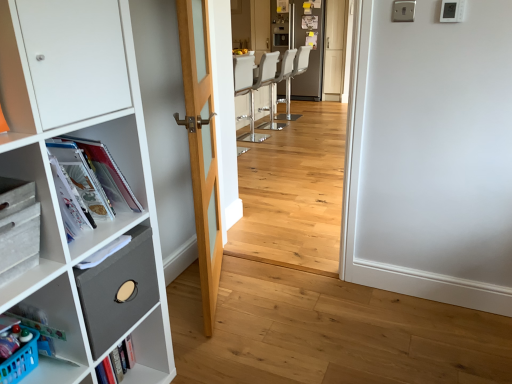
Find the location of a particular element. The height and width of the screenshot is (384, 512). light wood floor at center is located at coordinates (294, 191).

What is the approximate height of light wood floor at center?

The height of light wood floor at center is 4.80 feet.

What is the approximate height of white leather bar stool at center, acting as the 2th armchair starting from the front?

white leather bar stool at center, acting as the 2th armchair starting from the front, is 1.02 meters tall.

The image size is (512, 384). In order to click on white leather barstool at center, the first armchair viewed from the front in this screenshot , I will do (276, 82).

Where is `white glossy refrigerator at upper center`? white glossy refrigerator at upper center is located at coordinates (312, 65).

Which of these two, matte plastic magazines at left or light wood floor at center, stands shorter?

matte plastic magazines at left.

Can you confirm if matte plastic magazines at left is thinner than light wood floor at center?

No, matte plastic magazines at left is not thinner than light wood floor at center.

Which object is positioned more to the right, matte plastic magazines at left or light wood floor at center?

From the viewer's perspective, light wood floor at center appears more on the right side.

From the image's perspective, between matte plastic magazines at left and light wood floor at center, who is located below?

matte plastic magazines at left is shown below in the image.

From the picture: Is natural wood door at center far away from white leather barstool at center, the second armchair viewed from the back?

Yes, natural wood door at center and white leather barstool at center, the second armchair viewed from the back, are quite far apart.

In the image, is natural wood door at center positioned in front of or behind white leather barstool at center, the second armchair viewed from the back?

natural wood door at center is positioned closer to the viewer than white leather barstool at center, the second armchair viewed from the back.

This screenshot has height=384, width=512. What are the coordinates of `the 1st armchair counting from the right of the natural wood door at center` in the screenshot? It's located at (276, 82).

Which of these two, natural wood door at center or white leather barstool at center, the second armchair viewed from the back, is thinner?

natural wood door at center is thinner.

Considering the positions of objects white leather bar stool at center and white leather bar stool at center, acting as the 2th armchair starting from the front, in the image provided, who is behind, white leather bar stool at center or white leather bar stool at center, acting as the 2th armchair starting from the front,?

white leather bar stool at center, acting as the 2th armchair starting from the front, is more distant.

Is white leather bar stool at center surrounding white leather bar stool at center, which appears as the 1th armchair when viewed from the back?

No, white leather bar stool at center, which appears as the 1th armchair when viewed from the back, is not surrounded by white leather bar stool at center.

Is white leather bar stool at center turned away from white leather bar stool at center, acting as the 2th armchair starting from the front?

No, white leather bar stool at center, acting as the 2th armchair starting from the front, is not at the back of white leather bar stool at center.

Is white leather bar stool at center placed right next to white leather bar stool at center, acting as the 2th armchair starting from the front?

No, white leather bar stool at center is not next to white leather bar stool at center, acting as the 2th armchair starting from the front.

Is there a large distance between matte gray drawer at left and light wood floor at center?

Yes, matte gray drawer at left is far from light wood floor at center.

Is matte gray drawer at left at the right side of light wood floor at center?

No.

Is matte gray drawer at left aimed at light wood floor at center?

No, matte gray drawer at left is not aimed at light wood floor at center.

Considering the relative sizes of matte gray drawer at left and light wood floor at center in the image provided, is matte gray drawer at left thinner than light wood floor at center?

Incorrect, the width of matte gray drawer at left is not less than that of light wood floor at center.

Is white glossy refrigerator at upper center beside light wood floor at center?

white glossy refrigerator at upper center and light wood floor at center are not in contact.

Is light wood floor at center a part of white glossy refrigerator at upper center?

No, light wood floor at center is not surrounded by white glossy refrigerator at upper center.

Is point (314, 61) closer or farther from the camera than point (286, 212)?

Point (314, 61) is positioned farther from the camera compared to point (286, 212).

Which object is more forward, white glossy refrigerator at upper center or light wood floor at center?

light wood floor at center is closer to the camera.

How many degrees apart are the facing directions of white leather bar stool at center, which appears as the 1th armchair when viewed from the back, and white leather barstool at center, the first armchair viewed from the front?

The facing directions of white leather bar stool at center, which appears as the 1th armchair when viewed from the back, and white leather barstool at center, the first armchair viewed from the front, are 0.000219 degrees apart.

In the scene shown: Considering the relative sizes of white leather bar stool at center, which appears as the 1th armchair when viewed from the back, and white leather barstool at center, the first armchair viewed from the front, in the image provided, is white leather bar stool at center, which appears as the 1th armchair when viewed from the back, shorter than white leather barstool at center, the first armchair viewed from the front,?

Indeed, white leather bar stool at center, which appears as the 1th armchair when viewed from the back, has a lesser height compared to white leather barstool at center, the first armchair viewed from the front.

From the image's perspective, is white leather bar stool at center, acting as the 2th armchair starting from the front, on white leather barstool at center, the second armchair viewed from the back?

Yes, from the image's perspective, white leather bar stool at center, acting as the 2th armchair starting from the front, is above white leather barstool at center, the second armchair viewed from the back.

Which object is further away from the camera taking this photo, white leather bar stool at center, acting as the 2th armchair starting from the front, or white leather barstool at center, the second armchair viewed from the back?

white leather bar stool at center, acting as the 2th armchair starting from the front, is further from the camera.

Considering the sizes of objects white leather bar stool at center, acting as the 2th armchair starting from the front, and white glossy refrigerator at upper center in the image provided, who is taller, white leather bar stool at center, acting as the 2th armchair starting from the front, or white glossy refrigerator at upper center?

white glossy refrigerator at upper center is taller.

In the scene shown: Between white leather bar stool at center, acting as the 2th armchair starting from the front, and white glossy refrigerator at upper center, which one appears on the left side from the viewer's perspective?

white leather bar stool at center, acting as the 2th armchair starting from the front, is more to the left.

Which object is more forward, white leather bar stool at center, acting as the 2th armchair starting from the front, or white glossy refrigerator at upper center?

white leather bar stool at center, acting as the 2th armchair starting from the front.

At what (x,y) coordinates should I click in order to perform the action: click on corridor on the right of matte plastic magazines at left. Please return your answer as a coordinate pair (x, y). Looking at the image, I should click on (294, 191).

At what (x,y) coordinates should I click in order to perform the action: click on door on the left of white leather barstool at center, the first armchair viewed from the front. Please return your answer as a coordinate pair (x, y). Looking at the image, I should click on (201, 147).

From the picture: Estimate the real-world distances between objects in this image. Which object is further from matte plastic magazines at left, white leather bar stool at center or white leather barstool at center, the first armchair viewed from the front?

Among the two, white leather barstool at center, the first armchair viewed from the front, is located further to matte plastic magazines at left.

Estimate the real-world distances between objects in this image. Which object is closer to matte plastic magazines at left, white leather bar stool at center, acting as the 2th armchair starting from the front, or white leather bar stool at center?

Based on the image, white leather bar stool at center appears to be nearer to matte plastic magazines at left.

Which object lies nearer to the anchor point white glossy refrigerator at upper center, matte plastic magazines at left or white leather barstool at center, the second armchair viewed from the back?

Based on the image, white leather barstool at center, the second armchair viewed from the back, appears to be nearer to white glossy refrigerator at upper center.

When comparing their distances from white leather barstool at center, the first armchair viewed from the front, does light wood floor at center or matte gray drawer at left seem closer?

light wood floor at center is closer to white leather barstool at center, the first armchair viewed from the front.

Estimate the real-world distances between objects in this image. Which object is further from white leather bar stool at center, matte gray drawer at left or light wood floor at center?

matte gray drawer at left is further to white leather bar stool at center.

From the image, which object appears to be nearer to white leather barstool at center, the second armchair viewed from the back, matte plastic magazines at left or matte gray drawer at left?

The object closer to white leather barstool at center, the second armchair viewed from the back, is matte plastic magazines at left.

Looking at the image, which one is located further to white leather bar stool at center, matte gray drawer at left or matte plastic magazines at left?

matte gray drawer at left is positioned further to the anchor white leather bar stool at center.

Estimate the real-world distances between objects in this image. Which object is closer to white glossy refrigerator at upper center, natural wood door at center or white leather bar stool at center, acting as the 2th armchair starting from the front?

white leather bar stool at center, acting as the 2th armchair starting from the front, is closer to white glossy refrigerator at upper center.

Find the location of a particular element. corridor between natural wood door at center and white leather bar stool at center in the front-back direction is located at coordinates (294, 191).

You are a GUI agent. You are given a task and a screenshot of the screen. Output one action in this format:
    pyautogui.click(x=<x>, y=<y>)
    Task: Click on the chair positioned between light wood floor at center and white leather barstool at center, the first armchair viewed from the front, from near to far
    The width and height of the screenshot is (512, 384).
    Given the screenshot: What is the action you would take?
    pyautogui.click(x=257, y=89)

I want to click on magazine between matte gray drawer at left and white leather bar stool at center in the front-back direction, so point(97,174).

The image size is (512, 384). Identify the location of corridor between matte plastic magazines at left and white leather bar stool at center, acting as the 2th armchair starting from the front, along the z-axis. (294, 191).